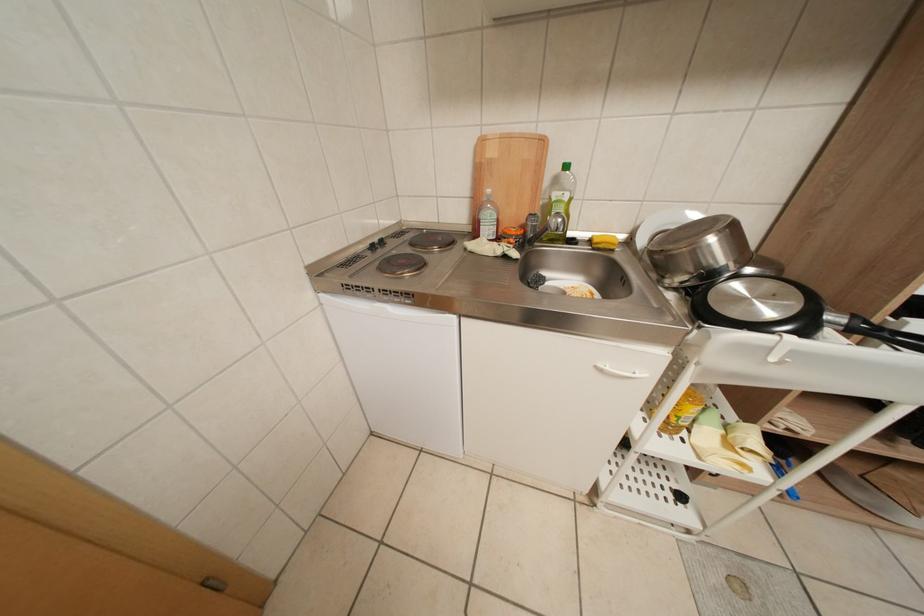
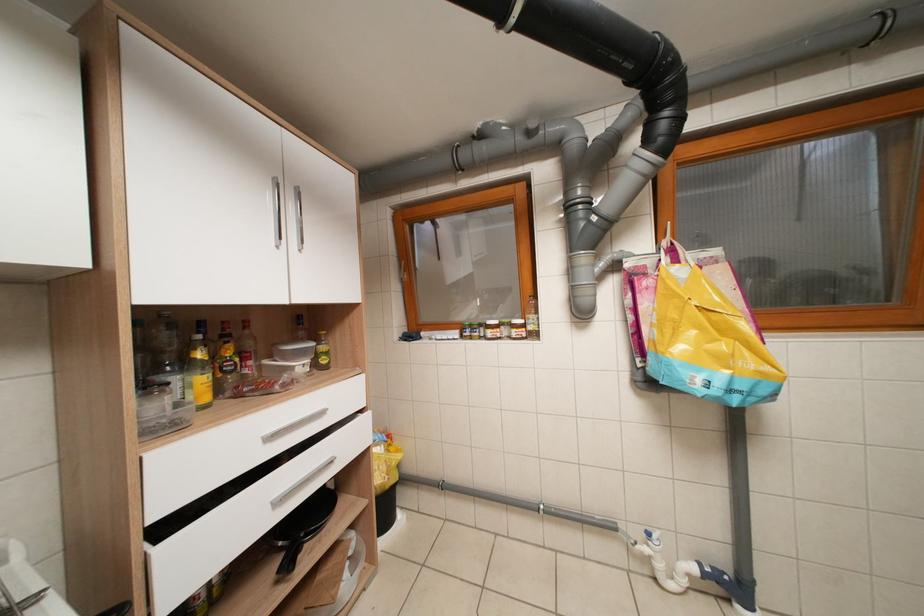
Question: The camera is either moving clockwise (left) or counter-clockwise (right) around the object. The first image is from the beginning of the video and the second image is from the end. Is the camera moving left or right when shooting the video?

Choices:
 (A) Left
 (B) Right

Answer: (A)